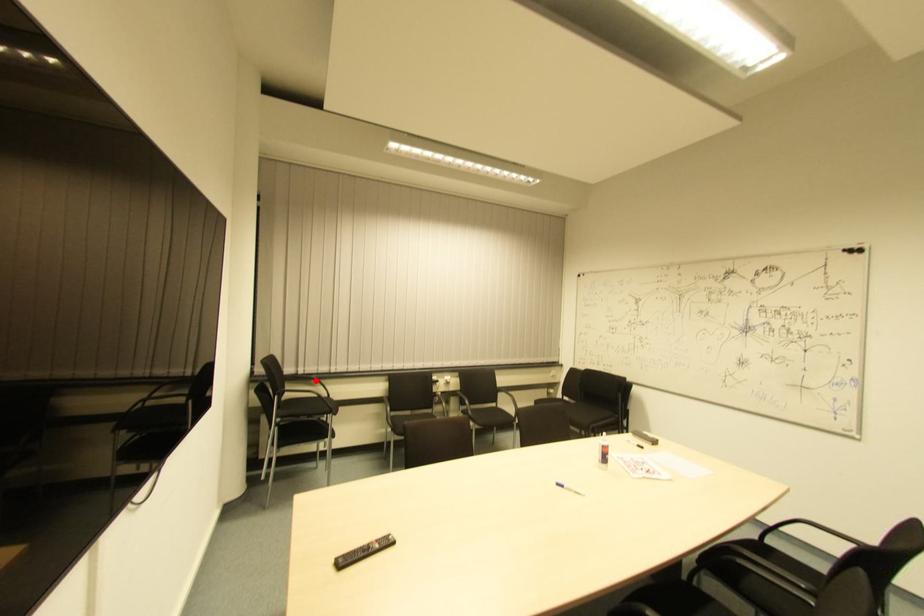
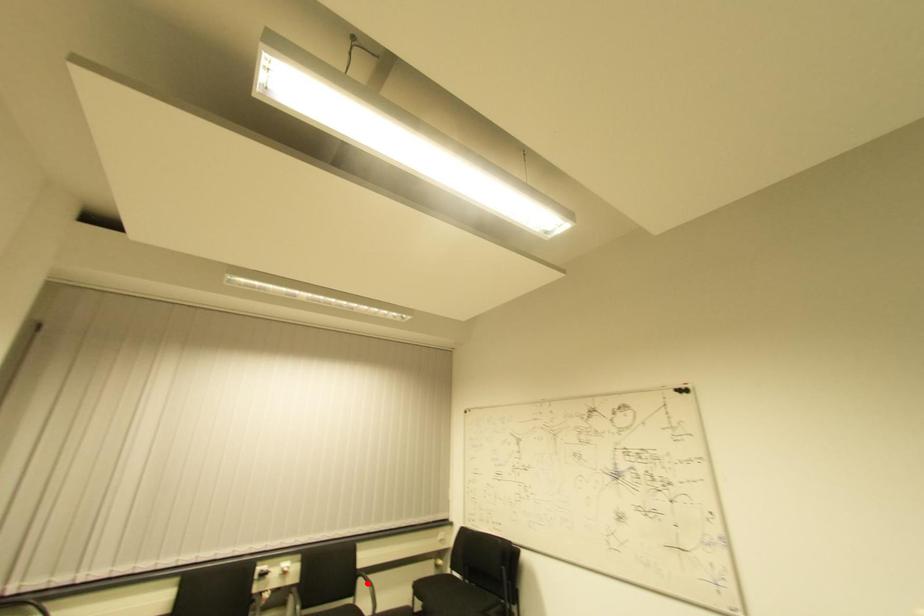
I am providing you with two images of the same scene from different viewpoints. A red point is marked on the first image and another point is marked on the second image. Are the points marked in image1 and image2 representing the same 3D position?

No